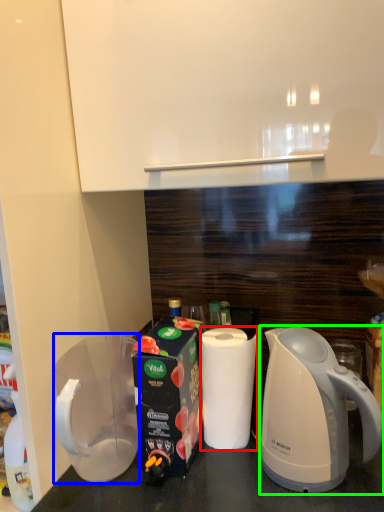
Question: Estimate the real-world distances between objects in this image. Which object is farther from paper towel (highlighted by a red box), pitcher (highlighted by a blue box) or kettle (highlighted by a green box)?

Choices:
 (A) pitcher
 (B) kettle

Answer: (A)